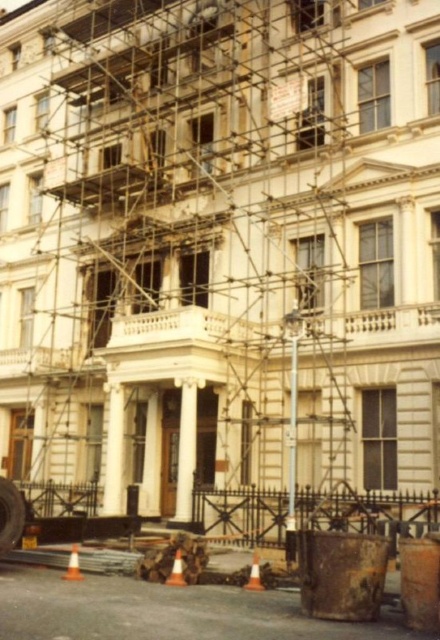
You are a construction worker who needs to move a heavy tool from the rusty metal dumpster at lower right to the orange traffic cone at lower center. Which direction should you move the tool relative to the dumpster?

The rusty metal dumpster at lower right is to the left of the orange traffic cone at lower center, so you should move the tool to the right to reach the cone.

You are a construction worker needing to transport a 1.2 meter wide wooden plank to the site. The path between the white marble column at center and the orange traffic cone at lower center is available. Can the plank fit through the space between them?

The white marble column at center is wider than the orange traffic cone at lower center. Since the plank is 1.2 meters wide, the space between them may be sufficient if the narrower side of the column and cone allows passage. However, without exact distance measurements, it is uncertain. The worker should measure the narrowest point between them before attempting to move the plank.

You are standing at the point with coordinates point (x=161, y=611). Looking at the image, what object are you standing on?

You are standing on the rusty metal dumpster at lower right.